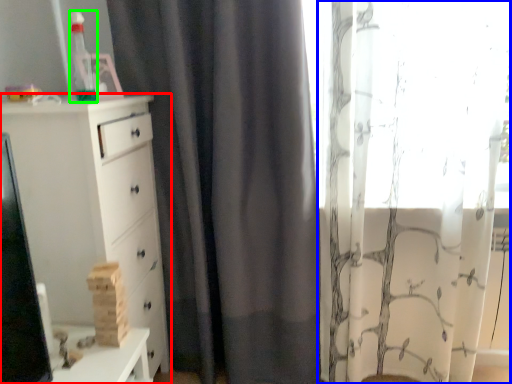
Question: Considering the real-world distances, which object is closest to chest of drawers (highlighted by a red box)? curtain (highlighted by a blue box) or toy (highlighted by a green box).

Choices:
 (A) curtain
 (B) toy

Answer: (B)